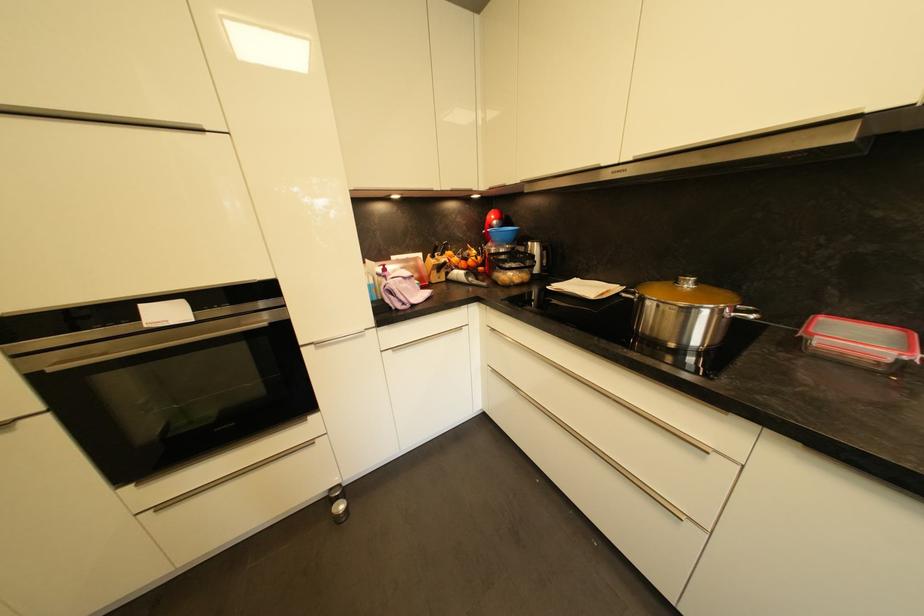
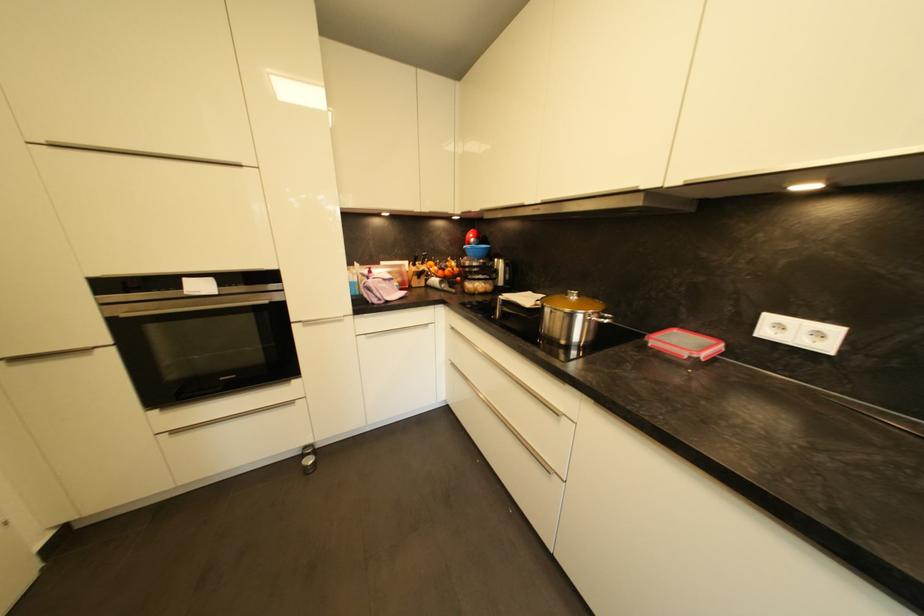
What movement of the cameraman would produce the second image?

The movement direction of the cameraman is right, backward.